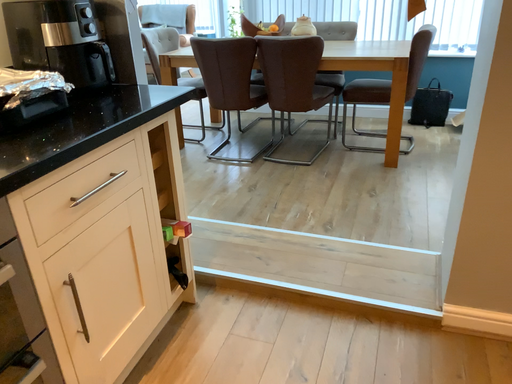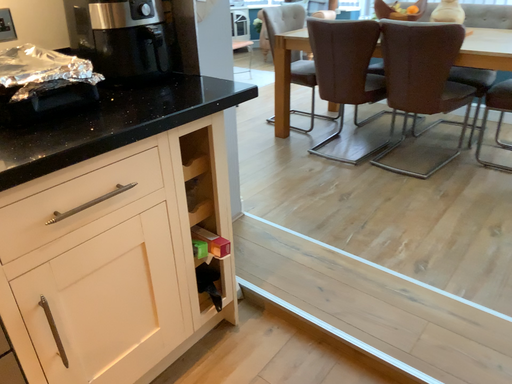
Question: How did the camera likely rotate when shooting the video?

Choices:
 (A) rotated left
 (B) rotated right

Answer: (A)